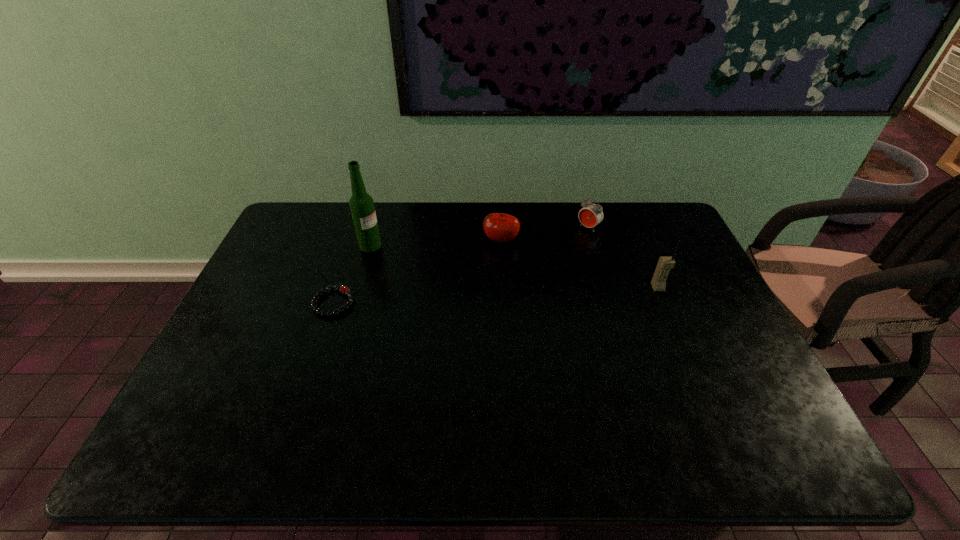
I want to click on free space that is in between the second object from right to left and the third object from right to left, so click(x=544, y=234).

Where is `free space that is in between the bracelet and the beer bottle`? This screenshot has width=960, height=540. free space that is in between the bracelet and the beer bottle is located at coordinates (352, 274).

You are a GUI agent. You are given a task and a screenshot of the screen. Output one action in this format:
    pyautogui.click(x=<x>, y=<y>)
    Task: Click on the free space that is in between the tallest object and the fourth object from left to right
    This screenshot has height=540, width=960.
    Given the screenshot: What is the action you would take?
    pyautogui.click(x=479, y=237)

Where is `blank region between the apple and the bracelet`? The image size is (960, 540). blank region between the apple and the bracelet is located at coordinates (418, 272).

Image resolution: width=960 pixels, height=540 pixels. I want to click on blank region between the shortest object and the third object from left to right, so click(x=418, y=272).

Locate an element on the screen. Image resolution: width=960 pixels, height=540 pixels. empty location between the second object from right to left and the beer bottle is located at coordinates (479, 237).

Locate an element on the screen. The width and height of the screenshot is (960, 540). free space between the tallest object and the alarm clock is located at coordinates (479, 237).

This screenshot has height=540, width=960. Find the location of `object that stands as the fourth closest to the shortest object`. object that stands as the fourth closest to the shortest object is located at coordinates (658, 282).

What are the coordinates of `object identified as the third closest to the second tallest object` in the screenshot? It's located at (361, 204).

Where is `free space that satisfies the following two spatial constraints: 1. on the back side of the beer bottle; 2. on the left side of the bracelet`? free space that satisfies the following two spatial constraints: 1. on the back side of the beer bottle; 2. on the left side of the bracelet is located at coordinates (353, 246).